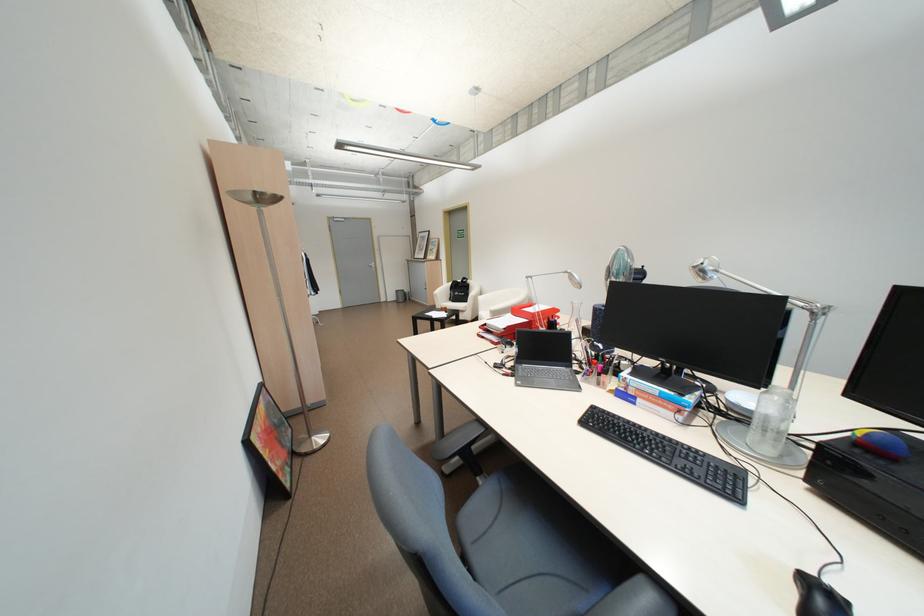
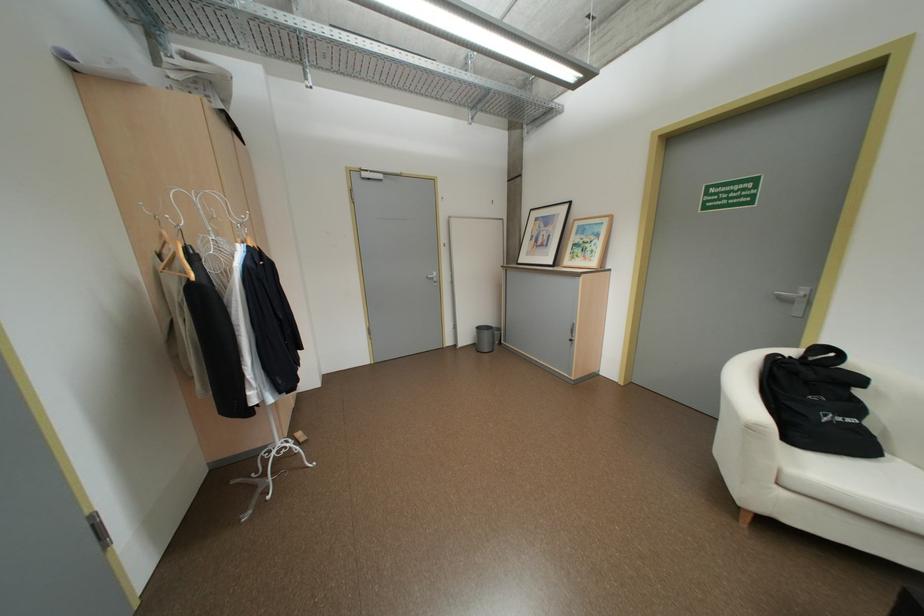
Find the pixel in the second image that matches (433,238) in the first image.

(556, 220)